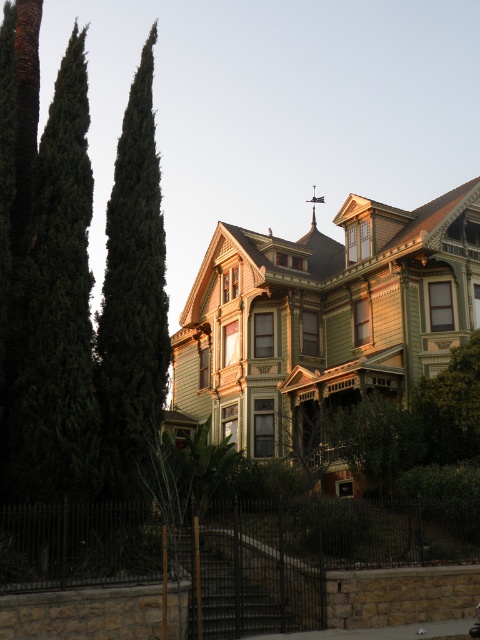
Question: Where is green textured tree at left located in relation to metallic spire at upper center in the image?

Choices:
 (A) right
 (B) left

Answer: (B)

Question: Does green textured tree at left come behind metallic spire at upper center?

Choices:
 (A) yes
 (B) no

Answer: (B)

Question: Which point is closer to the camera?

Choices:
 (A) (313, 195)
 (B) (153, 35)

Answer: (A)

Question: Which point is farther from the camera taking this photo?

Choices:
 (A) click(106, 337)
 (B) click(319, 196)

Answer: (B)

Question: In this image, where is green textured tree at left located relative to metallic spire at upper center?

Choices:
 (A) below
 (B) above

Answer: (B)

Question: Which of the following is the closest to the observer?

Choices:
 (A) (126, 282)
 (B) (312, 189)

Answer: (A)